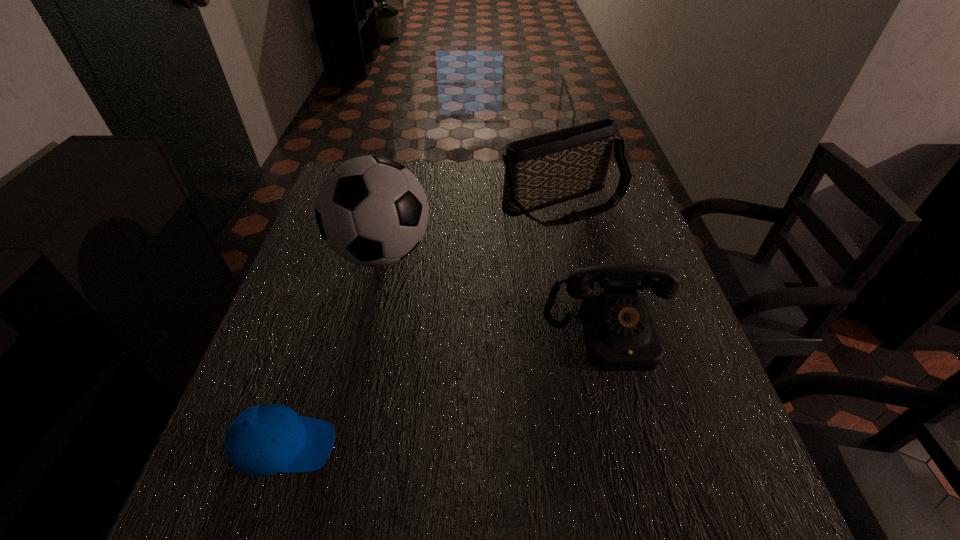
The height and width of the screenshot is (540, 960). Identify the location of vacant area at the right edge. (677, 340).

Locate an element on the screen. This screenshot has height=540, width=960. vacant space at the near left corner of the desktop is located at coordinates (232, 517).

In the image, there is a desktop. Where is `free space at the near right corner`? free space at the near right corner is located at coordinates click(x=681, y=478).

This screenshot has height=540, width=960. In order to click on empty location between the shortest object and the handbag in this screenshot , I will do `click(424, 325)`.

The height and width of the screenshot is (540, 960). What are the coordinates of `vacant area between the soccer ball and the cap` in the screenshot? It's located at tap(333, 349).

Locate an element on the screen. This screenshot has width=960, height=540. empty space that is in between the soccer ball and the second shortest object is located at coordinates (495, 295).

You are a GUI agent. You are given a task and a screenshot of the screen. Output one action in this format:
    pyautogui.click(x=<x>, y=<y>)
    Task: Click on the free spot between the tallest object and the handbag
    This screenshot has height=540, width=960.
    Given the screenshot: What is the action you would take?
    pyautogui.click(x=473, y=229)

Where is `vacant point located between the handbag and the cap`? Image resolution: width=960 pixels, height=540 pixels. vacant point located between the handbag and the cap is located at coordinates (424, 325).

This screenshot has width=960, height=540. Find the location of `vacant area between the second tallest object and the shortest object`. vacant area between the second tallest object and the shortest object is located at coordinates (424, 325).

Find the location of a particular element. This screenshot has width=960, height=540. empty space between the shortest object and the tallest object is located at coordinates (333, 349).